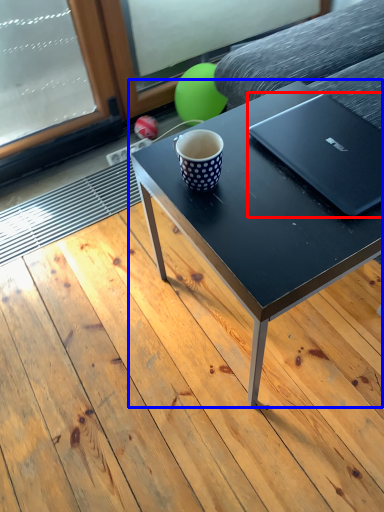
Question: Which of the following is the closest to the observer, laptop (highlighted by a red box) or coffee table (highlighted by a blue box)?

Choices:
 (A) laptop
 (B) coffee table

Answer: (B)